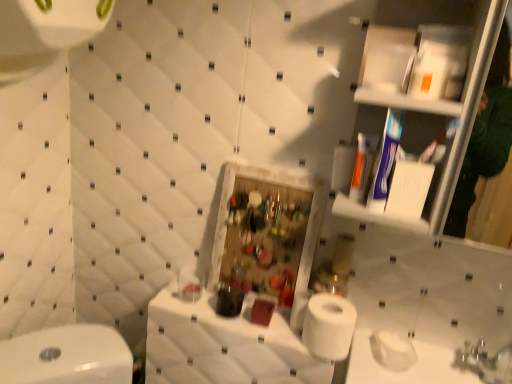
Identify the location of free spot above white fabric counter at center (from a real-world perspective). (231, 309).